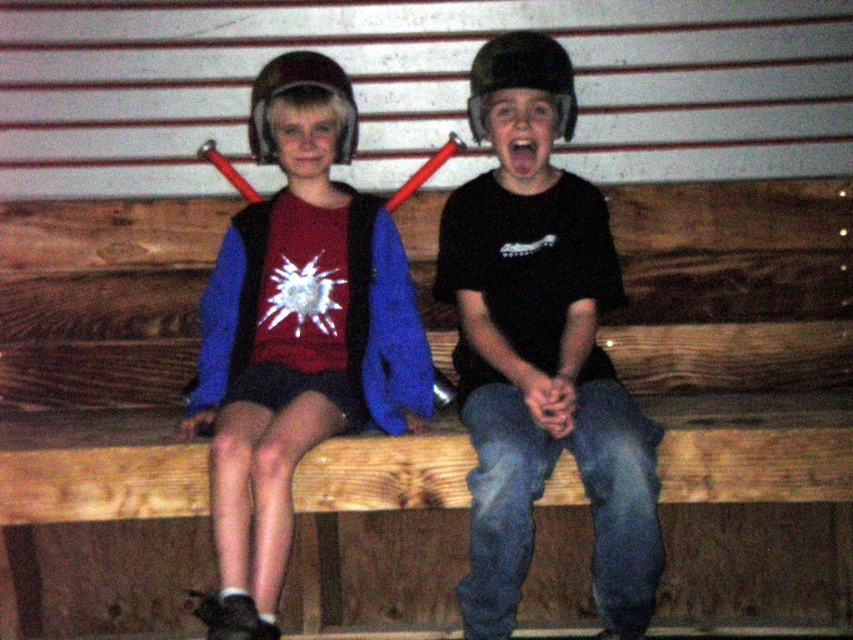
You are a safety inspector checking the helmets of two children sitting on a wooden bench in a barn. You notice the matte black helmet at center and the matte plastic helmet at upper center. Which helmet has a lower height?

The matte black helmet at center is shorter than the matte plastic helmet at upper center, so the matte black helmet at center has a lower height.

Where is the black matte helmet at center located in the image?

The black matte helmet at center is located at point (540, 348) in the image.

You are a safety inspector checking the helmets in the image. You see the black matte helmet at center and the matte plastic helmet at upper center. Which helmet is positioned lower?

The black matte helmet at center is located below the matte plastic helmet at upper center, so it is positioned lower.